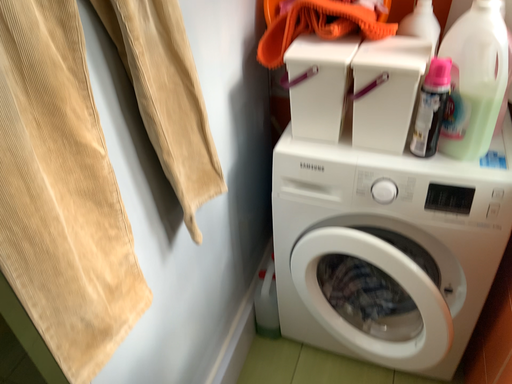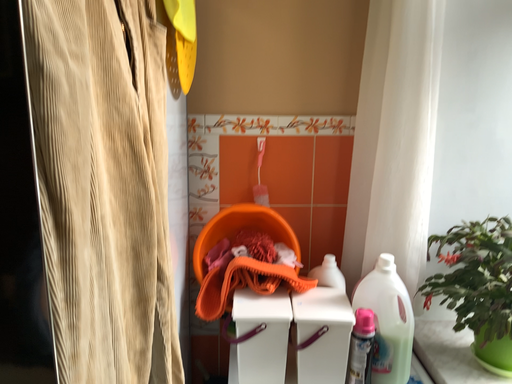
Question: Which way did the camera rotate in the video?

Choices:
 (A) rotated upward
 (B) rotated downward

Answer: (A)